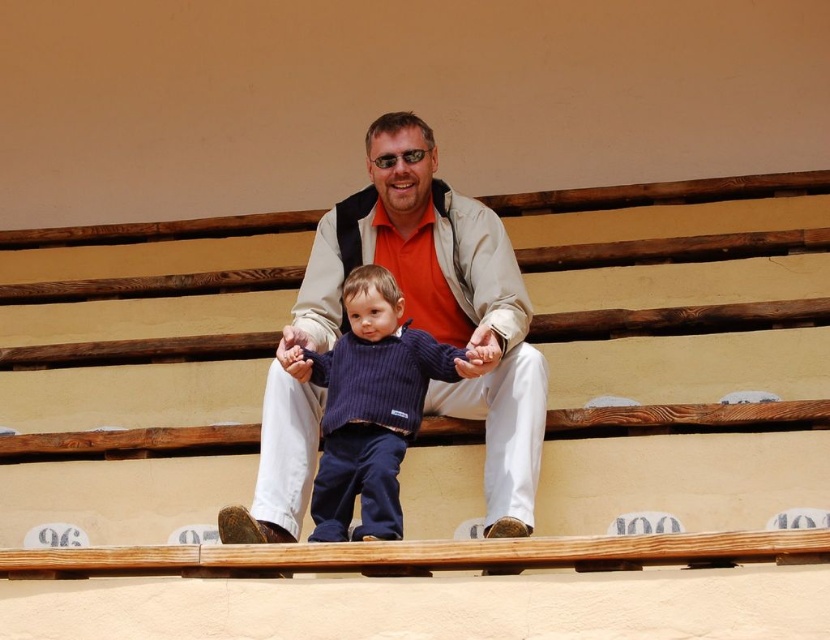
Question: Which point appears closest to the camera in this image?

Choices:
 (A) (x=218, y=424)
 (B) (x=359, y=410)
 (C) (x=440, y=236)

Answer: (B)

Question: Does wooden at center have a smaller size compared to dark blue ribbed sweater at center?

Choices:
 (A) no
 (B) yes

Answer: (A)

Question: Which point is closer to the camera?

Choices:
 (A) matte beige jacket at center
 (B) dark blue ribbed sweater at center

Answer: (A)

Question: Can you confirm if wooden at center is wider than matte beige jacket at center?

Choices:
 (A) no
 (B) yes

Answer: (B)

Question: Which of the following is the closest to the observer?

Choices:
 (A) wooden at center
 (B) matte beige jacket at center
 (C) dark blue ribbed sweater at center

Answer: (A)

Question: Does wooden at center have a greater width compared to matte beige jacket at center?

Choices:
 (A) yes
 (B) no

Answer: (A)